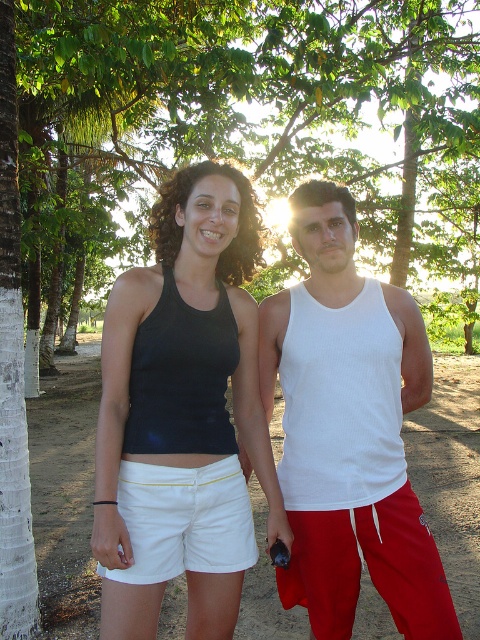
You are planning to take a photo of the white bark tree at center and the white cotton shorts at center. Which object should you focus on first if you want to capture both in the same frame without moving the camera?

The white bark tree at center is bigger than the white cotton shorts at center, so you should focus on the white bark tree at center first to ensure it fits properly in the frame before adjusting for the smaller white cotton shorts at center.

You are planning to take a photo of the two people in the image. You want to ensure that both the white ribbed tank top at center and the white cotton shorts at center are visible in the frame. Based on their positions, which one should you focus on first to frame them properly?

The white ribbed tank top at center is positioned on the right side of white cotton shorts at center, so you should focus on the white cotton shorts at center first to ensure both are in frame.

You are a photographer trying to capture both the black matte tank top at center and the white cotton shorts at center in a single frame. Given that your camera has a minimum focus distance of 6 inches, will you be able to focus on both subjects simultaneously?

The distance between the black matte tank top at center and the white cotton shorts at center is 7.14 inches, which is greater than the camera minimum focus distance of 6 inches. Therefore, you can focus on both subjects simultaneously.